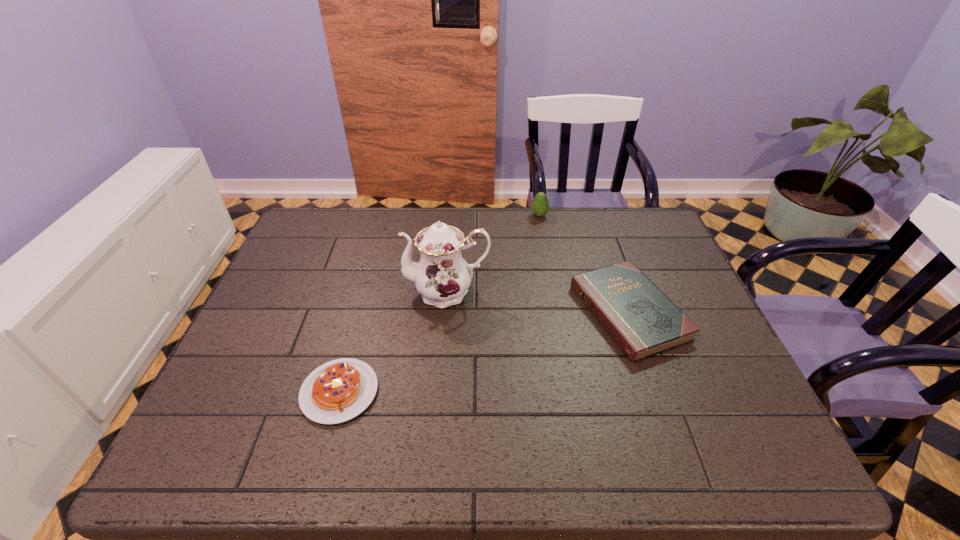
Image resolution: width=960 pixels, height=540 pixels. I want to click on vacant area that lies between the third shortest object and the tallest object, so click(x=493, y=253).

Identify the location of unoccupied position between the third object from left to right and the tallest object. (493, 253).

In order to click on vacant point located between the farthest object and the Bible in this screenshot , I will do `click(584, 264)`.

The width and height of the screenshot is (960, 540). What are the coordinates of `free spot between the rightmost object and the leftmost object` in the screenshot? It's located at (484, 352).

Identify the location of empty space that is in between the leftmost object and the chinaware. (394, 342).

At what (x,y) coordinates should I click in order to perform the action: click on free space between the chinaware and the shortest object. Please return your answer as a coordinate pair (x, y). Looking at the image, I should click on (394, 342).

Find the location of `object that is the second closest to the rightmost object`. object that is the second closest to the rightmost object is located at coordinates (540, 205).

The height and width of the screenshot is (540, 960). Identify the location of the second closest object to the avocado. (442, 277).

This screenshot has width=960, height=540. I want to click on vacant region that satisfies the following two spatial constraints: 1. on the back side of the shortest object; 2. on the right side of the rightmost object, so pyautogui.click(x=361, y=313).